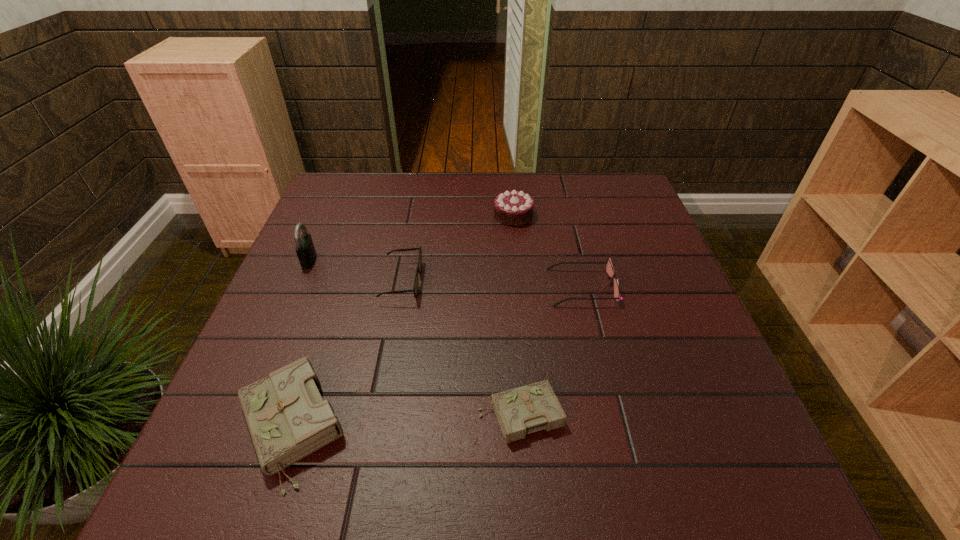
The height and width of the screenshot is (540, 960). Find the location of `object that is at the near left corner`. object that is at the near left corner is located at coordinates (287, 418).

In the image, there is a desktop. Where is `free region at the far edge`? free region at the far edge is located at coordinates (567, 186).

This screenshot has width=960, height=540. In the image, there is a desktop. Identify the location of vacant space at the near edge. (632, 427).

What are the coordinates of `free space at the left edge of the desktop` in the screenshot? It's located at tap(243, 363).

I want to click on blank space at the right edge, so click(646, 225).

In order to click on free region at the far left corner of the desktop in this screenshot , I will do `click(366, 183)`.

Locate an element on the screen. The width and height of the screenshot is (960, 540). vacant space at the far right corner of the desktop is located at coordinates (634, 188).

In the image, there is a desktop. Where is `free region at the near right corner`? Image resolution: width=960 pixels, height=540 pixels. free region at the near right corner is located at coordinates [743, 431].

At what (x,y) coordinates should I click in order to perform the action: click on vacant region between the fifth shortest object and the rightmost object. Please return your answer as a coordinate pair (x, y). Looking at the image, I should click on (548, 251).

Where is `vacant region between the rightmost object and the fifth shortest object`? This screenshot has height=540, width=960. vacant region between the rightmost object and the fifth shortest object is located at coordinates (548, 251).